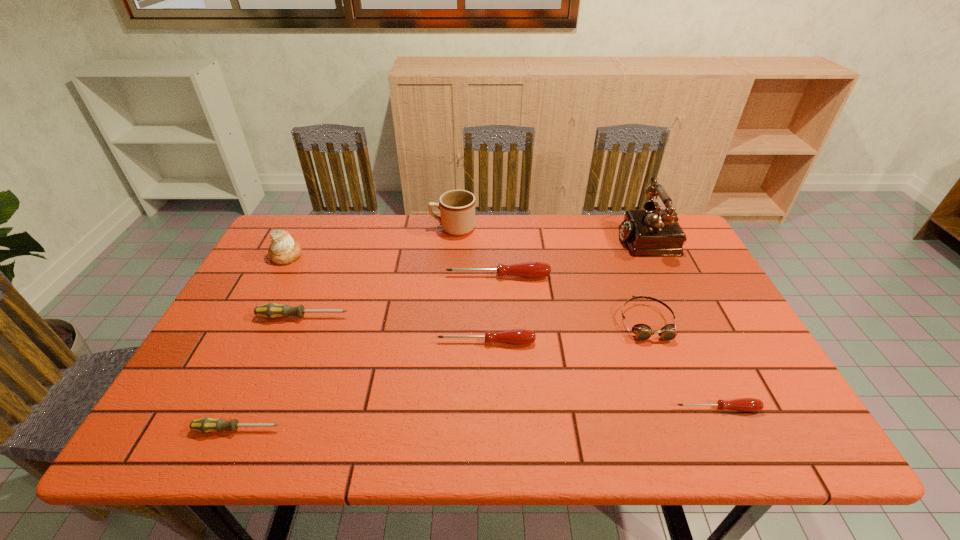
Select which red screwdriver is the second closest to the nearer gray screwdriver. Please provide its 2D coordinates. Your answer should be formatted as a tuple, i.e. [(x, y)], where the tuple contains the x and y coordinates of a point satisfying the conditions above.

[(529, 269)]

This screenshot has height=540, width=960. I want to click on the second closest red screwdriver to the brown mug, so click(518, 336).

Where is `free space that satisfies the following two spatial constraints: 1. through the lenses of the goggles; 2. at the tip of the nearest object`? This screenshot has width=960, height=540. free space that satisfies the following two spatial constraints: 1. through the lenses of the goggles; 2. at the tip of the nearest object is located at coordinates (688, 429).

This screenshot has height=540, width=960. In order to click on blank area in the image that satisfies the following two spatial constraints: 1. through the lenses of the eighth farthest object; 2. on the left side of the goggles in this screenshot , I will do `click(680, 408)`.

The height and width of the screenshot is (540, 960). Identify the location of vacant space that satisfies the following two spatial constraints: 1. at the tip of the second farthest screwdriver; 2. on the right side of the nearest red screwdriver. (265, 408).

Identify the location of free point that satisfies the following two spatial constraints: 1. at the tip of the second biggest red screwdriver; 2. on the left side of the second farthest screwdriver. This screenshot has width=960, height=540. (293, 342).

Locate an element on the screen. free spot that satisfies the following two spatial constraints: 1. on the front side of the farthest red screwdriver; 2. at the tip of the farther gray screwdriver is located at coordinates (500, 317).